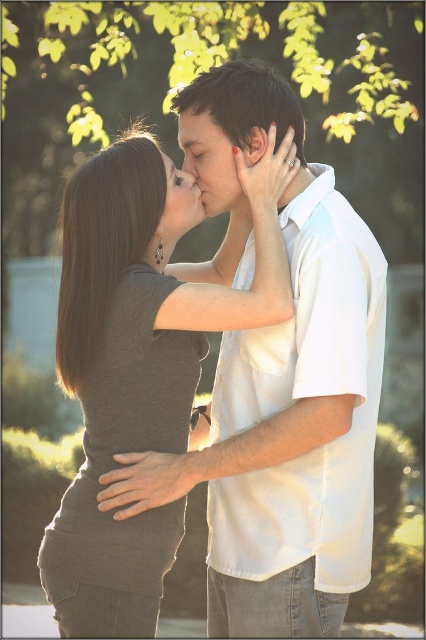
From the picture: You are a photographer trying to capture a closeup shot of the matte gray shirt at center and the matte white face at center. Which object should you focus on first if you want to ensure both are in focus?

The matte gray shirt at center is in front of the matte white face at center. To ensure both are in focus, you should focus on the matte white face at center first since it is further back, allowing the depth of field to cover both objects.